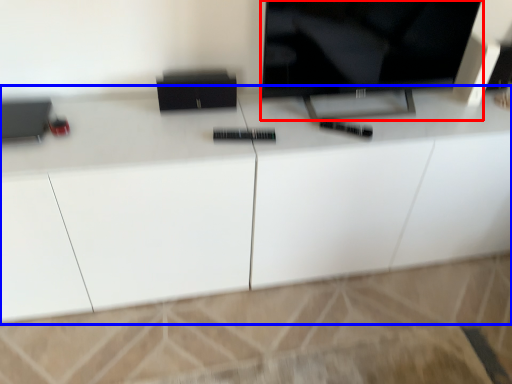
Question: Which of the following is the closest to the observer, television (highlighted by a red box) or cabinetry (highlighted by a blue box)?

Choices:
 (A) television
 (B) cabinetry

Answer: (B)